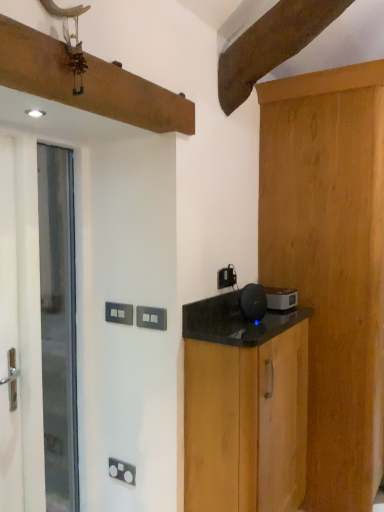
Question: Would you say black plastic electric outlet at upper center, which is the first electric outlet from back to front, is to the left or to the right of white matte screen door at left in the picture?

Choices:
 (A) left
 (B) right

Answer: (B)

Question: Is black plastic electric outlet at upper center, the 1th electric outlet from the top, inside the boundaries of white matte screen door at left, or outside?

Choices:
 (A) outside
 (B) inside

Answer: (A)

Question: Which object is the closest to the black wood cabinet at right, marked as the 2th cabinetry in a right-to-left arrangement?

Choices:
 (A) white plastic switch at center, the 3th electric outlet in the back-to-front sequence
 (B) white matte screen door at left
 (C) black plastic speaker at center, which is counted as the 1th appliance, starting from the left
 (D) light brown wood cabinet at right, positioned as the 1th cabinetry in right-to-left order
 (E) white glossy door at left

Answer: (A)

Question: Estimate the real-world distances between objects in this image. Which object is farther from the black plastic speaker at center, the 2th appliance when ordered from back to front?

Choices:
 (A) black wood cabinet at right, marked as the 2th cabinetry in a right-to-left arrangement
 (B) white plastic switch at center, which is counted as the 2th electric outlet, starting from the back
 (C) white matte screen door at left
 (D) white glossy door at left
 (E) satin black speaker at right, acting as the second appliance starting from the front

Answer: (C)